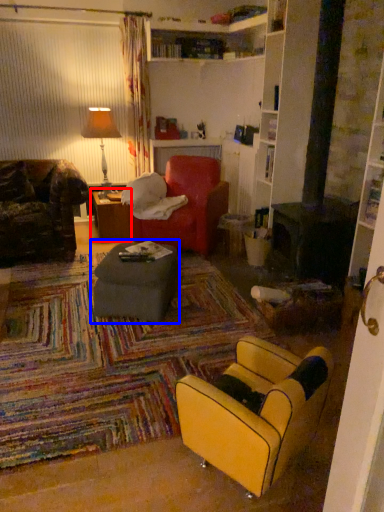
Question: Which of the following is the farthest to the observer, table (highlighted by a red box) or table (highlighted by a blue box)?

Choices:
 (A) table
 (B) table

Answer: (A)